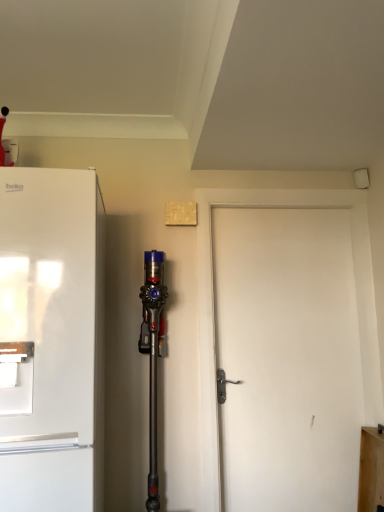
Question: Would you say white matte door at center is to the left or to the right of white matte refrigerator at left in the picture?

Choices:
 (A) right
 (B) left

Answer: (A)

Question: Is white matte door at center situated inside white matte refrigerator at left or outside?

Choices:
 (A) inside
 (B) outside

Answer: (B)

Question: From a real-world perspective, is white matte door at center above or below white matte refrigerator at left?

Choices:
 (A) below
 (B) above

Answer: (A)

Question: Relative to white matte door at center, is white matte refrigerator at left in front or behind?

Choices:
 (A) behind
 (B) front

Answer: (B)

Question: From the image's perspective, is white matte refrigerator at left above or below white matte door at center?

Choices:
 (A) above
 (B) below

Answer: (A)

Question: Based on their positions, is white matte refrigerator at left located to the left or right of white matte door at center?

Choices:
 (A) right
 (B) left

Answer: (B)

Question: Looking at their shapes, would you say white matte refrigerator at left is wider or thinner than white matte door at center?

Choices:
 (A) wide
 (B) thin

Answer: (A)